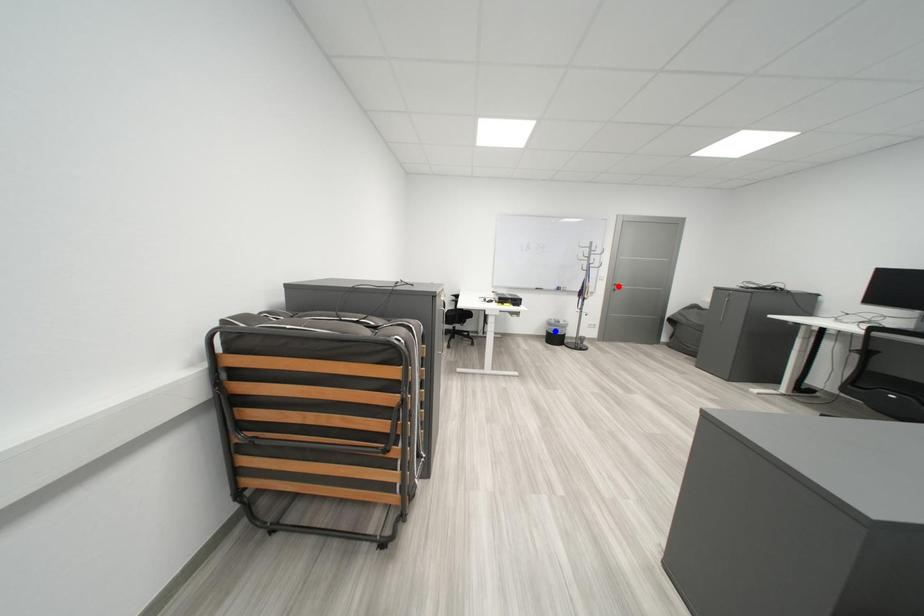
Question: Two points are marked on the image. Which point is closer to the camera?

Choices:
 (A) Blue point is closer.
 (B) Red point is closer.

Answer: (A)